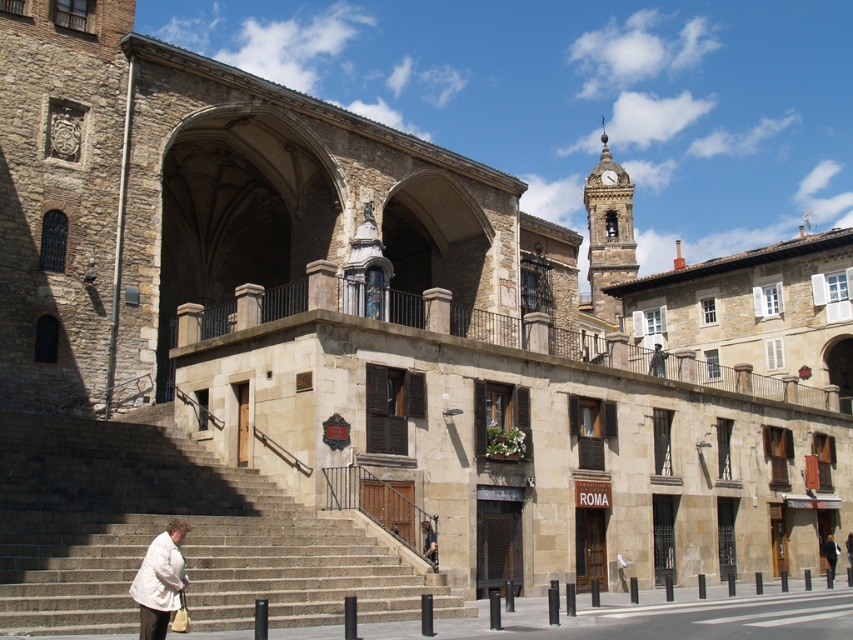
Question: Considering the relative positions of stone stairs at center and white matte jacket at lower left in the image provided, where is stone stairs at center located with respect to white matte jacket at lower left?

Choices:
 (A) below
 (B) above

Answer: (A)

Question: Is stone stairs at center smaller than light beige coat at lower center?

Choices:
 (A) yes
 (B) no

Answer: (B)

Question: Which object is farther from the camera taking this photo?

Choices:
 (A) stone stairs at center
 (B) white matte jacket at lower left
 (C) dark brown leather jacket at lower center
 (D) dark gray jacket at lower right

Answer: (D)

Question: Which of these objects is positioned farthest from the stone stairs at center?

Choices:
 (A) dark brown leather jacket at lower center
 (B) light beige coat at lower center

Answer: (B)

Question: Observing the image, what is the correct spatial positioning of white matte jacket at lower left in reference to light beige coat at lower center?

Choices:
 (A) left
 (B) right

Answer: (A)

Question: Which point is farther to the camera?

Choices:
 (A) dark gray jacket at lower right
 (B) stone stairs at center

Answer: (A)